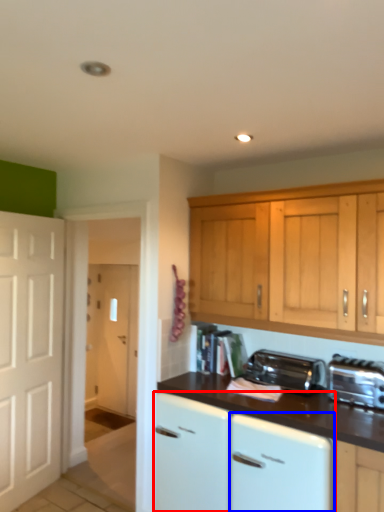
Question: Which point is closer to the camera, cabinetry (highlighted by a red box) or dish washer (highlighted by a blue box)?

Choices:
 (A) cabinetry
 (B) dish washer

Answer: (B)